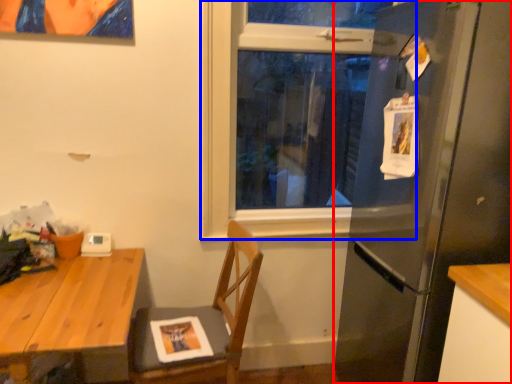
Question: Which object is further to the camera taking this photo, refrigerator (highlighted by a red box) or window (highlighted by a blue box)?

Choices:
 (A) refrigerator
 (B) window

Answer: (B)